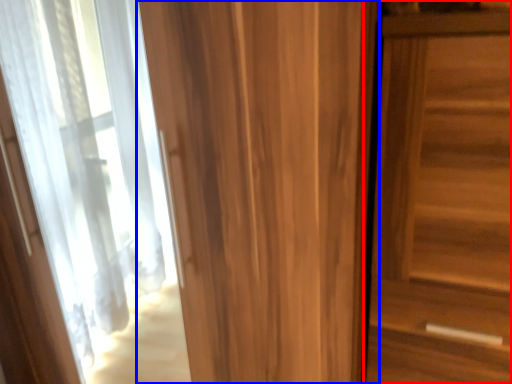
Question: Which of the following is the closest to the observer, door (highlighted by a red box) or door (highlighted by a blue box)?

Choices:
 (A) door
 (B) door

Answer: (B)